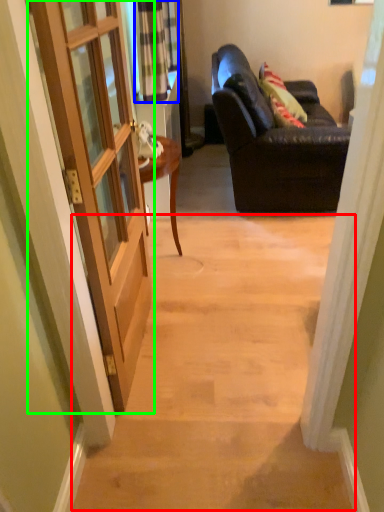
Question: Which object is the closest to the stairwell (highlighted by a red box)? Choose among these: curtain (highlighted by a blue box) or door (highlighted by a green box).

Choices:
 (A) curtain
 (B) door

Answer: (B)